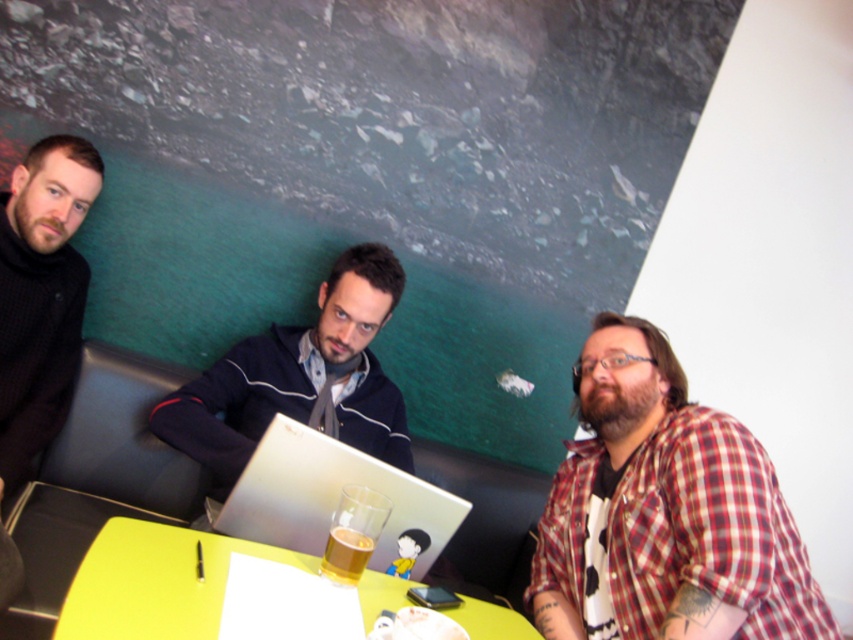
Is dark blue jacket at center taller than silver metallic laptop at center?

Correct, dark blue jacket at center is much taller as silver metallic laptop at center.

The image size is (853, 640). Find the location of `dark blue jacket at center`. dark blue jacket at center is located at coordinates (299, 378).

This screenshot has height=640, width=853. What are the coordinates of `dark blue jacket at center` in the screenshot? It's located at (299, 378).

Based on the photo, is yellow matte table at lower center positioned before translucent glass beer at table center?

Yes, it is.

Is yellow matte table at lower center to the left of translucent glass beer at table center from the viewer's perspective?

Yes, yellow matte table at lower center is to the left of translucent glass beer at table center.

At what (x,y) coordinates should I click in order to perform the action: click on yellow matte table at lower center. Please return your answer as a coordinate pair (x, y). The image size is (853, 640). Looking at the image, I should click on (155, 582).

Is dark blue jacket at center to the left of yellow matte table at lower center from the viewer's perspective?

Indeed, dark blue jacket at center is positioned on the left side of yellow matte table at lower center.

Is dark blue jacket at center smaller than yellow matte table at lower center?

No.

Between point (173, 419) and point (108, 598), which one is positioned in front?

Point (108, 598)

The width and height of the screenshot is (853, 640). I want to click on dark blue jacket at center, so click(299, 378).